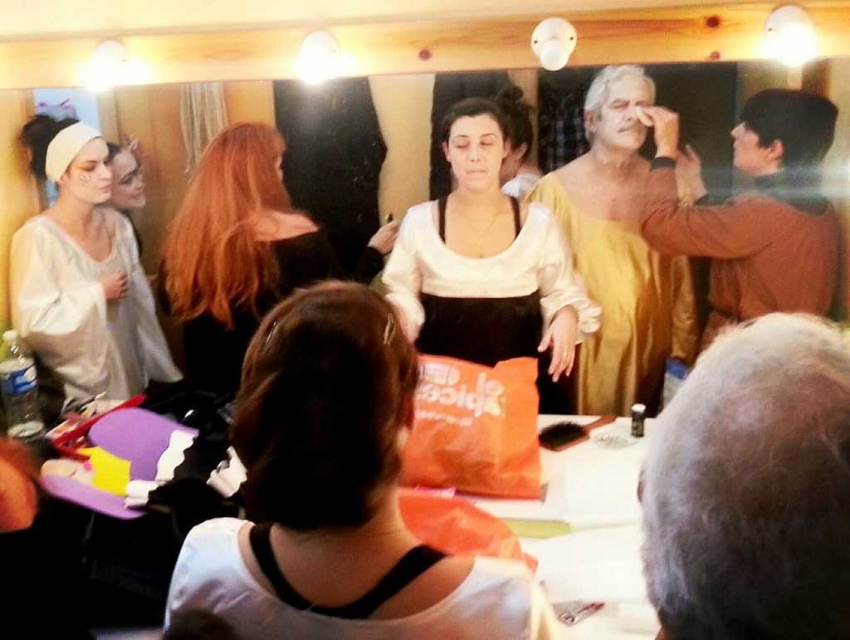
Is white matte fabric at left positioned behind black satin dress at center?

Yes.

Is point (123, 260) less distant than point (313, 232)?

No, (123, 260) is behind (313, 232).

The height and width of the screenshot is (640, 850). What do you see at coordinates (83, 275) in the screenshot?
I see `white matte fabric at left` at bounding box center [83, 275].

Identify the location of white matte fabric at left. (83, 275).

Can you confirm if white matte fabric at left is wider than orange fabric bag at center?

In fact, white matte fabric at left might be narrower than orange fabric bag at center.

I want to click on white matte fabric at left, so click(x=83, y=275).

The height and width of the screenshot is (640, 850). In order to click on white matte fabric at left in this screenshot , I will do `click(83, 275)`.

The width and height of the screenshot is (850, 640). Identify the location of white matte fabric at left. (83, 275).

Is point (442, 268) closer to viewer compared to point (306, 237)?

No, it is behind (306, 237).

Does white matte apron at center come behind shiny brown hair at center?

No, white matte apron at center is in front of shiny brown hair at center.

Is point (468, 156) more distant than point (235, 204)?

Yes, point (468, 156) is farther from viewer.

Locate an element on the screen. This screenshot has height=640, width=850. white matte apron at center is located at coordinates (486, 264).